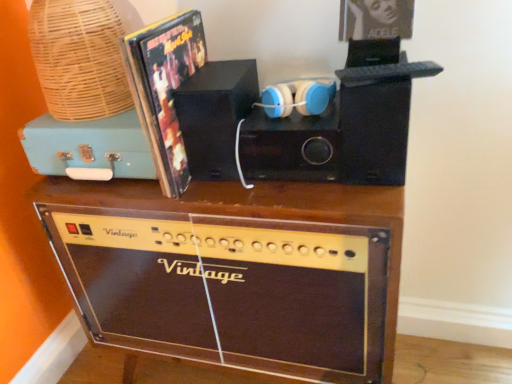
Question: Is black matte speaker at center, the 2th speaker positioned from the left, positioned with its back to brown wood amplifier at lower center?

Choices:
 (A) no
 (B) yes

Answer: (A)

Question: From the image's perspective, is black matte speaker at center, the first speaker when ordered from right to left, under brown wood amplifier at lower center?

Choices:
 (A) no
 (B) yes

Answer: (A)

Question: Does black matte speaker at center, the 2th speaker positioned from the left, have a greater width compared to brown wood amplifier at lower center?

Choices:
 (A) yes
 (B) no

Answer: (B)

Question: From a real-world perspective, does black matte speaker at center, the first speaker when ordered from right to left, stand above brown wood amplifier at lower center?

Choices:
 (A) no
 (B) yes

Answer: (B)

Question: Does black matte speaker at center, the first speaker when ordered from right to left, have a smaller size compared to brown wood amplifier at lower center?

Choices:
 (A) yes
 (B) no

Answer: (A)

Question: Is teal matte suitcase at upper left taller or shorter than black matte speaker at center, which is the first speaker in left-to-right order?

Choices:
 (A) short
 (B) tall

Answer: (A)

Question: Based on their sizes in the image, would you say teal matte suitcase at upper left is bigger or smaller than black matte speaker at center, which is the first speaker in left-to-right order?

Choices:
 (A) big
 (B) small

Answer: (A)

Question: From a real-world perspective, relative to black matte speaker at center, which is the first speaker in left-to-right order, is teal matte suitcase at upper left vertically above or below?

Choices:
 (A) below
 (B) above

Answer: (A)

Question: Considering the positions of teal matte suitcase at upper left and black matte speaker at center, which is the first speaker in left-to-right order, in the image, is teal matte suitcase at upper left wider or thinner than black matte speaker at center, which is the first speaker in left-to-right order,?

Choices:
 (A) wide
 (B) thin

Answer: (A)

Question: Looking at their shapes, would you say woven bamboo basket at upper left is wider or thinner than black matte speaker at center, the first speaker when ordered from right to left?

Choices:
 (A) wide
 (B) thin

Answer: (A)

Question: Considering the positions of point (50, 8) and point (259, 173), is point (50, 8) closer or farther from the camera than point (259, 173)?

Choices:
 (A) farther
 (B) closer

Answer: (B)

Question: From a real-world perspective, is woven bamboo basket at upper left above or below black matte speaker at center, the 2th speaker positioned from the left?

Choices:
 (A) below
 (B) above

Answer: (B)

Question: Considering the relative positions of woven bamboo basket at upper left and black matte speaker at center, the 2th speaker positioned from the left, in the image provided, is woven bamboo basket at upper left to the left or to the right of black matte speaker at center, the 2th speaker positioned from the left,?

Choices:
 (A) right
 (B) left

Answer: (B)

Question: From their relative heights in the image, would you say black matte speaker at center, which is the first speaker in left-to-right order, is taller or shorter than blue matte headphones at center?

Choices:
 (A) short
 (B) tall

Answer: (B)

Question: Looking at their shapes, would you say black matte speaker at center, which is the first speaker in left-to-right order, is wider or thinner than blue matte headphones at center?

Choices:
 (A) thin
 (B) wide

Answer: (B)